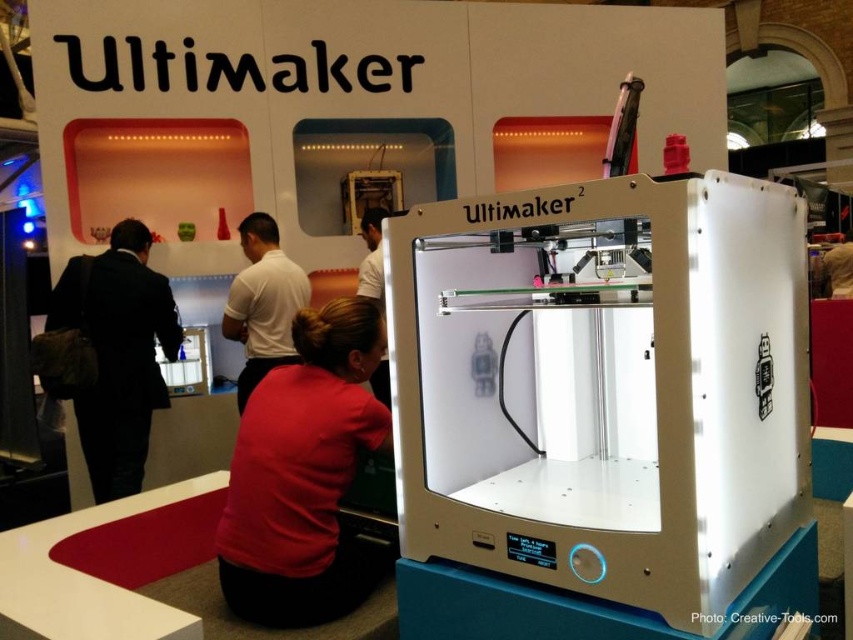
You are at the trade show and want to take a photo of the Ultimaker 2 3D printer. There are two people in your way, the red matte shirt at lower center and the black suit at left. Which person should you ask to move so you can get a clearer view of the printer?

You should ask the red matte shirt at lower center to move because they are closer to the viewer than the black suit at left, blocking the view more directly.

You are a photographer at the exhibition and need to capture both the black suit at left and the matte white shirt at center in a single photo. Based on their positions, which one should you focus on first to ensure both are in frame?

The black suit at left is below the matte white shirt at center, so you should focus on the matte white shirt at center first to ensure both are in frame.